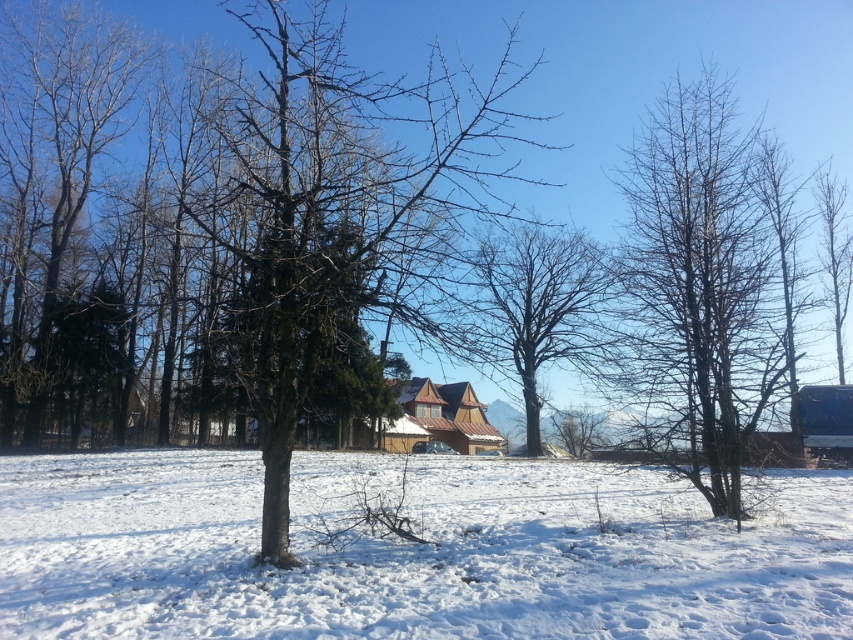
Is white fluffy snow at center closer to the viewer compared to brown rough bark tree at center?

That is True.

Does point (646, 632) come farther from viewer compared to point (291, 432)?

No, (646, 632) is closer to viewer.

You are a GUI agent. You are given a task and a screenshot of the screen. Output one action in this format:
    pyautogui.click(x=<x>, y=<y>)
    Task: Click on the white fluffy snow at center
    The image size is (853, 640).
    Given the screenshot: What is the action you would take?
    pyautogui.click(x=412, y=552)

Is white fluffy snow at center closer to camera compared to bare branches at center?

Yes.

Between white fluffy snow at center and bare branches at center, which one is positioned lower?

Positioned lower is white fluffy snow at center.

Does point (686, 580) come farther from viewer compared to point (698, 99)?

That is False.

The image size is (853, 640). Identify the location of white fluffy snow at center. point(412,552).

Does white fluffy snow at center have a lesser height compared to bare wood tree at left?

Yes, white fluffy snow at center is shorter than bare wood tree at left.

Which is behind, point (315, 630) or point (96, 86)?

Point (96, 86)

What do you see at coordinates (412, 552) in the screenshot? I see `white fluffy snow at center` at bounding box center [412, 552].

I want to click on white fluffy snow at center, so click(x=412, y=552).